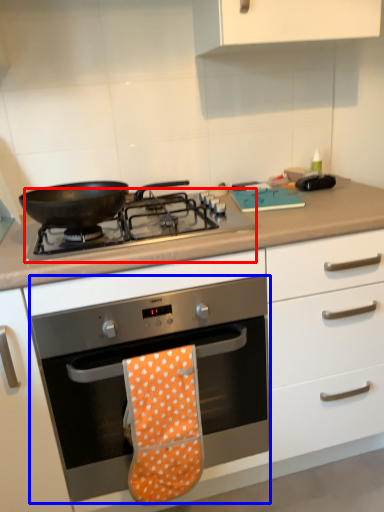
Question: Which object appears closest to the camera in this image, gas stove (highlighted by a red box) or oven (highlighted by a blue box)?

Choices:
 (A) gas stove
 (B) oven

Answer: (B)